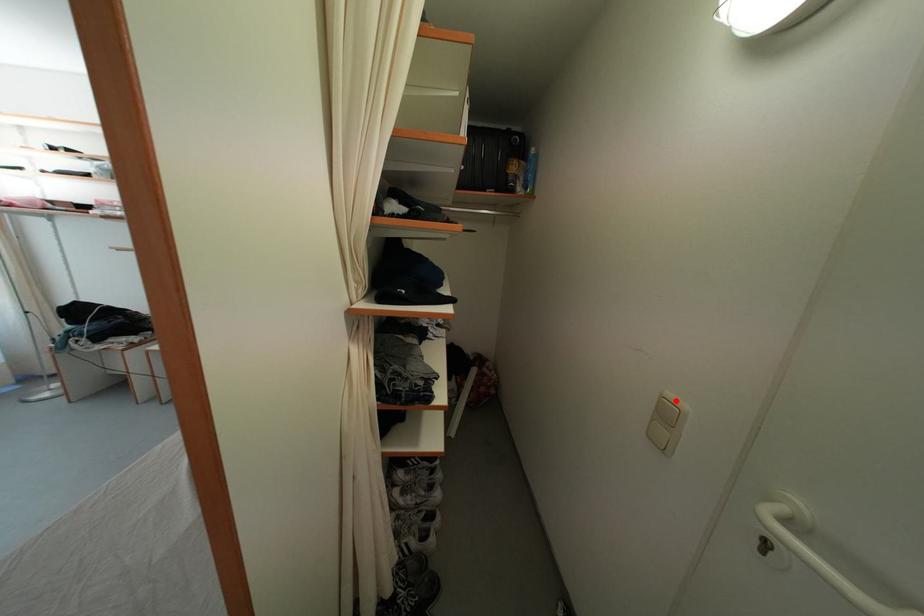
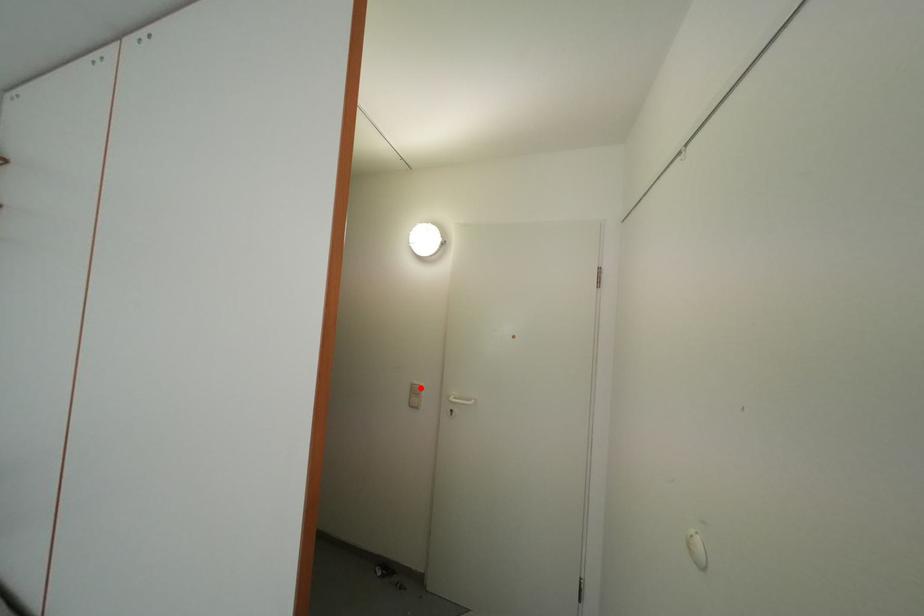
I am providing you with two images of the same scene from different viewpoints. A red point is marked on the first image and another point is marked on the second image. Is the red point in image1 aligned with the point shown in image2?

Yes